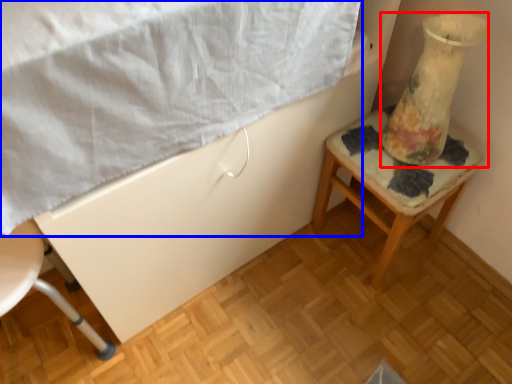
Question: Which point is closer to the camera, glass vase (highlighted by a red box) or sheet (highlighted by a blue box)?

Choices:
 (A) glass vase
 (B) sheet

Answer: (B)